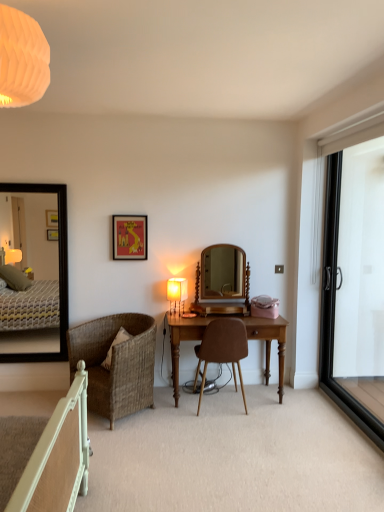
Question: Is wooden mirror at center, which appears as the 2th mirror when viewed from the left, turned away from wooden desk at center?

Choices:
 (A) yes
 (B) no

Answer: (B)

Question: From a real-world perspective, is wooden mirror at center, which is counted as the 1th mirror, starting from the right, located beneath wooden desk at center?

Choices:
 (A) yes
 (B) no

Answer: (B)

Question: Can you confirm if wooden mirror at center, which is counted as the 1th mirror, starting from the right, is shorter than wooden desk at center?

Choices:
 (A) yes
 (B) no

Answer: (A)

Question: Is the depth of wooden mirror at center, which appears as the 2th mirror when viewed from the left, greater than that of wooden desk at center?

Choices:
 (A) no
 (B) yes

Answer: (B)

Question: Is wooden mirror at center, which appears as the 2th mirror when viewed from the left, smaller than wooden desk at center?

Choices:
 (A) no
 (B) yes

Answer: (B)

Question: Visually, is matte white power outlet at center-right positioned to the left or to the right of woven rattan chair at lower left, the first chair viewed from the left?

Choices:
 (A) left
 (B) right

Answer: (B)

Question: Considering the positions of matte white power outlet at center-right and woven rattan chair at lower left, the second chair from the right, in the image, is matte white power outlet at center-right bigger or smaller than woven rattan chair at lower left, the second chair from the right,?

Choices:
 (A) small
 (B) big

Answer: (A)

Question: Is matte white power outlet at center-right spatially inside woven rattan chair at lower left, the first chair viewed from the left, or outside of it?

Choices:
 (A) outside
 (B) inside

Answer: (A)

Question: Does point (281, 266) appear closer or farther from the camera than point (107, 382)?

Choices:
 (A) farther
 (B) closer

Answer: (A)

Question: From the image's perspective, relative to black glass screen door at right, is black framed mirror at left, the 2th mirror from the right, above or below?

Choices:
 (A) above
 (B) below

Answer: (A)

Question: Considering the positions of black framed mirror at left, the 2th mirror from the right, and black glass screen door at right in the image, is black framed mirror at left, the 2th mirror from the right, wider or thinner than black glass screen door at right?

Choices:
 (A) wide
 (B) thin

Answer: (B)

Question: Considering the relative positions of black framed mirror at left, the 2th mirror from the right, and black glass screen door at right in the image provided, is black framed mirror at left, the 2th mirror from the right, to the left or to the right of black glass screen door at right?

Choices:
 (A) right
 (B) left

Answer: (B)

Question: Considering the positions of black framed mirror at left, the first mirror positioned from the left, and black glass screen door at right in the image, is black framed mirror at left, the first mirror positioned from the left, taller or shorter than black glass screen door at right?

Choices:
 (A) tall
 (B) short

Answer: (B)

Question: Is point (221, 276) closer or farther from the camera than point (276, 265)?

Choices:
 (A) farther
 (B) closer

Answer: (B)

Question: From a real-world perspective, is wooden mirror at center, which appears as the 2th mirror when viewed from the left, above or below matte white power outlet at center-right?

Choices:
 (A) below
 (B) above

Answer: (A)